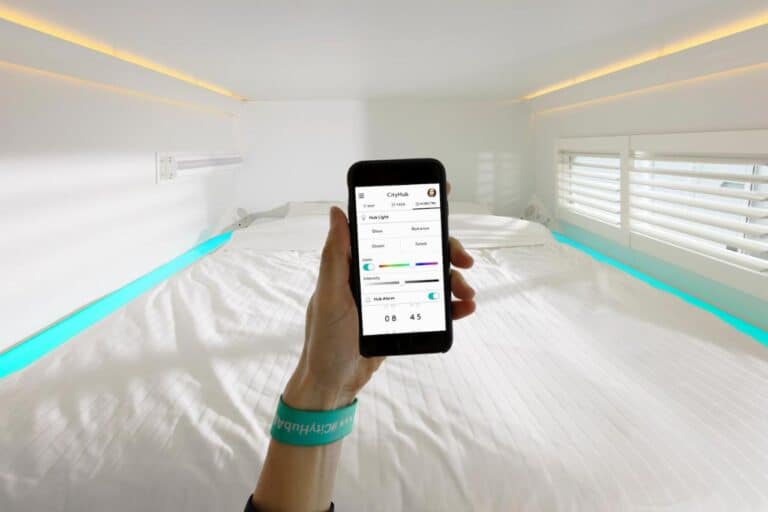
Where is `yellow light`? The width and height of the screenshot is (768, 512). yellow light is located at coordinates (740, 25), (746, 69), (84, 41), (90, 84).